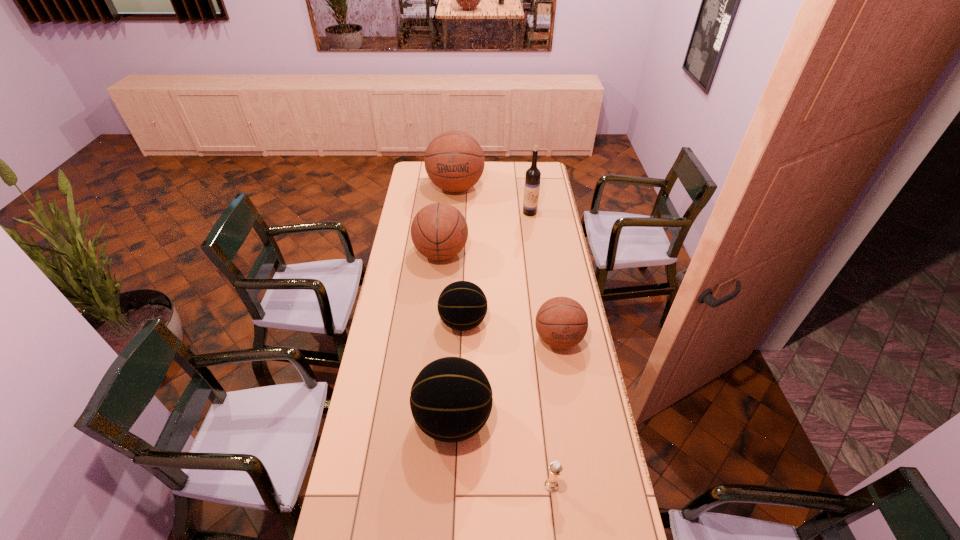
Locate an element on the screen. blank region between the smallest brown basketball and the nearest object is located at coordinates (555, 412).

You are a GUI agent. You are given a task and a screenshot of the screen. Output one action in this format:
    pyautogui.click(x=<x>, y=<y>)
    Task: Click on the empty space between the rightmost basketball and the black wine bottle
    
    Given the screenshot: What is the action you would take?
    pyautogui.click(x=544, y=275)

Find the location of a particular element. This screenshot has width=960, height=540. vacant space that is in between the farther black basketball and the second farthest object is located at coordinates (496, 267).

The width and height of the screenshot is (960, 540). In order to click on blank region between the second farthest object and the farther black basketball in this screenshot , I will do `click(496, 267)`.

I want to click on object that is the closest to the smaller black basketball, so click(561, 322).

You are a GUI agent. You are given a task and a screenshot of the screen. Output one action in this format:
    pyautogui.click(x=<x>, y=<y>)
    Task: Click on the object that can be found as the sixth closest to the farther black basketball
    The width and height of the screenshot is (960, 540).
    Given the screenshot: What is the action you would take?
    pyautogui.click(x=454, y=160)

This screenshot has height=540, width=960. Find the location of `the closest basketball relative to the sixth farthest object`. the closest basketball relative to the sixth farthest object is located at coordinates (462, 305).

The image size is (960, 540). In order to click on basketball that is the third closest to the wine bottle in this screenshot , I will do `click(462, 305)`.

Where is `the second closest brown basketball to the farther black basketball`? the second closest brown basketball to the farther black basketball is located at coordinates (439, 231).

Select which brown basketball appears as the closest to the third farthest object. Please provide its 2D coordinates. Your answer should be formatted as a tuple, i.e. [(x, y)], where the tuple contains the x and y coordinates of a point satisfying the conditions above.

[(454, 160)]